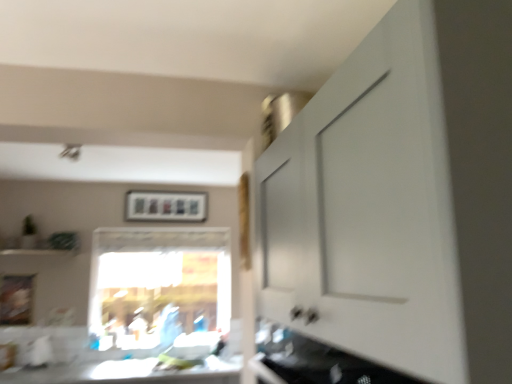
Measure the distance between point (x=263, y=327) and camera.

The depth of point (x=263, y=327) is 5.46 feet.

The height and width of the screenshot is (384, 512). I want to click on wooden picture frame at lower left, the second picture frame when ordered from right to left, so click(x=16, y=299).

How much space does matte plastic picture frame at upper center, which is the first picture frame from top to bottom, occupy horizontally?

The width of matte plastic picture frame at upper center, which is the first picture frame from top to bottom, is 3.11 inches.

This screenshot has width=512, height=384. Find the location of `white glossy cabinet at lower right, which is the first cabinetry from bottom to top`. white glossy cabinet at lower right, which is the first cabinetry from bottom to top is located at coordinates (315, 361).

Can you confirm if wooden picture frame at lower left, arranged as the second picture frame when viewed from the back, is thinner than white glossy countertop at lower center?

Yes.

Choose the correct answer: Is wooden picture frame at lower left, arranged as the second picture frame when viewed from the back, inside white glossy countertop at lower center or outside it?

wooden picture frame at lower left, arranged as the second picture frame when viewed from the back, lies outside white glossy countertop at lower center.

Does point (3, 299) lie in front of point (141, 383)?

That is False.

Is wooden picture frame at lower left, arranged as the 1th picture frame when ordered from the bottom, facing towards white glossy countertop at lower center?

No, wooden picture frame at lower left, arranged as the 1th picture frame when ordered from the bottom, is not aimed at white glossy countertop at lower center.

Is white matte cabinet at upper right, which appears as the first cabinetry when viewed from the top, located outside transparent glass window at center?

Indeed, white matte cabinet at upper right, which appears as the first cabinetry when viewed from the top, is completely outside transparent glass window at center.

Would you consider white matte cabinet at upper right, placed as the second cabinetry when sorted from bottom to top, to be distant from transparent glass window at center?

white matte cabinet at upper right, placed as the second cabinetry when sorted from bottom to top, is far away from transparent glass window at center.

Between white matte cabinet at upper right, which appears as the first cabinetry when viewed from the top, and transparent glass window at center, which one has smaller width?

transparent glass window at center is thinner.

Is white matte cabinet at upper right, which appears as the first cabinetry when viewed from the top, shorter than transparent glass window at center?

Yes.

Is white matte cabinet at upper right, placed as the second cabinetry when sorted from bottom to top, surrounding white glossy cabinet at lower right, which is the first cabinetry from bottom to top?

Absolutely, white glossy cabinet at lower right, which is the first cabinetry from bottom to top, is inside white matte cabinet at upper right, placed as the second cabinetry when sorted from bottom to top.

In the scene shown: From the image's perspective, which is above, white matte cabinet at upper right, which appears as the first cabinetry when viewed from the top, or white glossy cabinet at lower right, positioned as the 2th cabinetry in top-to-bottom order?

white matte cabinet at upper right, which appears as the first cabinetry when viewed from the top.

Is white matte cabinet at upper right, placed as the second cabinetry when sorted from bottom to top, facing towards white glossy cabinet at lower right, positioned as the 2th cabinetry in top-to-bottom order?

Yes, white matte cabinet at upper right, placed as the second cabinetry when sorted from bottom to top, faces towards white glossy cabinet at lower right, positioned as the 2th cabinetry in top-to-bottom order.

Considering the relative sizes of white glossy cabinet at lower right, positioned as the 2th cabinetry in top-to-bottom order, and white matte cabinet at upper right, which appears as the first cabinetry when viewed from the top, in the image provided, is white glossy cabinet at lower right, positioned as the 2th cabinetry in top-to-bottom order, taller than white matte cabinet at upper right, which appears as the first cabinetry when viewed from the top,?

In fact, white glossy cabinet at lower right, positioned as the 2th cabinetry in top-to-bottom order, may be shorter than white matte cabinet at upper right, which appears as the first cabinetry when viewed from the top.

How different are the orientations of white glossy cabinet at lower right, which is the first cabinetry from bottom to top, and white matte cabinet at upper right, which appears as the first cabinetry when viewed from the top, in degrees?

They differ by 0.000545 degrees in their facing directions.

How much distance is there between white glossy cabinet at lower right, positioned as the 2th cabinetry in top-to-bottom order, and white matte cabinet at upper right, placed as the second cabinetry when sorted from bottom to top?

11.42 inches.

Is point (273, 381) farther from viewer compared to point (289, 224)?

Yes.

At what (x,y) coordinates should I click in order to perform the action: click on the 2nd picture frame behind the white glossy cabinet at lower right, positioned as the 2th cabinetry in top-to-bottom order. Please return your answer as a coordinate pair (x, y). Looking at the image, I should click on (166, 206).

Consider the image. Is white glossy cabinet at lower right, positioned as the 2th cabinetry in top-to-bottom order, facing away from matte plastic picture frame at upper center, the first picture frame when ordered from back to front?

white glossy cabinet at lower right, positioned as the 2th cabinetry in top-to-bottom order, does not have its back to matte plastic picture frame at upper center, the first picture frame when ordered from back to front.

Is point (310, 381) closer to viewer compared to point (199, 218)?

Yes, point (310, 381) is closer to viewer.

Is white glossy cabinet at lower right, which is the first cabinetry from bottom to top, shorter than matte plastic picture frame at upper center, placed as the second picture frame when sorted from front to back?

Yes.

Is wooden picture frame at lower left, arranged as the second picture frame when viewed from the back, positioned with its back to white matte cabinet at upper right, which appears as the first cabinetry when viewed from the top?

wooden picture frame at lower left, arranged as the second picture frame when viewed from the back, is not turned away from white matte cabinet at upper right, which appears as the first cabinetry when viewed from the top.

Considering the sizes of wooden picture frame at lower left, arranged as the second picture frame when viewed from the back, and white matte cabinet at upper right, placed as the second cabinetry when sorted from bottom to top, in the image, is wooden picture frame at lower left, arranged as the second picture frame when viewed from the back, taller or shorter than white matte cabinet at upper right, placed as the second cabinetry when sorted from bottom to top,?

wooden picture frame at lower left, arranged as the second picture frame when viewed from the back, is shorter than white matte cabinet at upper right, placed as the second cabinetry when sorted from bottom to top.

From a real-world perspective, between wooden picture frame at lower left, arranged as the 1th picture frame when ordered from the bottom, and white matte cabinet at upper right, which appears as the first cabinetry when viewed from the top, who is vertically lower?

From a 3D spatial view, wooden picture frame at lower left, arranged as the 1th picture frame when ordered from the bottom, is below.

Does wooden picture frame at lower left, arranged as the second picture frame when viewed from the back, have a greater width compared to white matte cabinet at upper right, placed as the second cabinetry when sorted from bottom to top?

No, wooden picture frame at lower left, arranged as the second picture frame when viewed from the back, is not wider than white matte cabinet at upper right, placed as the second cabinetry when sorted from bottom to top.

Between white matte cabinet at upper right, which appears as the first cabinetry when viewed from the top, and wooden picture frame at lower left, marked as the first picture frame in a left-to-right arrangement, which one has less height?

With less height is wooden picture frame at lower left, marked as the first picture frame in a left-to-right arrangement.

Is white matte cabinet at upper right, placed as the second cabinetry when sorted from bottom to top, far away from wooden picture frame at lower left, arranged as the 1th picture frame when ordered from the bottom?

white matte cabinet at upper right, placed as the second cabinetry when sorted from bottom to top, is positioned a significant distance from wooden picture frame at lower left, arranged as the 1th picture frame when ordered from the bottom.

Which is behind, white matte cabinet at upper right, placed as the second cabinetry when sorted from bottom to top, or wooden picture frame at lower left, arranged as the second picture frame when viewed from the back?

wooden picture frame at lower left, arranged as the second picture frame when viewed from the back.

From a real-world perspective, is white matte cabinet at upper right, which appears as the first cabinetry when viewed from the top, on wooden picture frame at lower left, arranged as the 1th picture frame when ordered from the bottom?

Yes, from a real-world perspective, white matte cabinet at upper right, which appears as the first cabinetry when viewed from the top, is on top of wooden picture frame at lower left, arranged as the 1th picture frame when ordered from the bottom.

I want to click on counter top that is in front of the wooden picture frame at lower left, arranged as the 1th picture frame when ordered from the bottom, so click(x=122, y=373).

In the image, there is a white matte cabinet at upper right, which appears as the first cabinetry when viewed from the top. Where is `window below it (from a real-world perspective)`? The width and height of the screenshot is (512, 384). window below it (from a real-world perspective) is located at coordinates (160, 290).

Looking at the image, which one is located further to transparent glass window at center, white glossy countertop at lower center or white matte cabinet at upper right, which appears as the first cabinetry when viewed from the top?

white matte cabinet at upper right, which appears as the first cabinetry when viewed from the top, is positioned further to the anchor transparent glass window at center.

From the picture: Based on their spatial positions, is wooden picture frame at lower left, the second picture frame when ordered from right to left, or transparent glass window at center further from white matte cabinet at upper right, which appears as the first cabinetry when viewed from the top?

wooden picture frame at lower left, the second picture frame when ordered from right to left, lies further to white matte cabinet at upper right, which appears as the first cabinetry when viewed from the top, than the other object.

Estimate the real-world distances between objects in this image. Which object is further from white glossy countertop at lower center, white glossy cabinet at lower right, positioned as the 2th cabinetry in top-to-bottom order, or transparent glass window at center?

Based on the image, white glossy cabinet at lower right, positioned as the 2th cabinetry in top-to-bottom order, appears to be further to white glossy countertop at lower center.

When comparing their distances from white glossy cabinet at lower right, positioned as the 2th cabinetry in top-to-bottom order, does white matte cabinet at upper right, placed as the second cabinetry when sorted from bottom to top, or wooden picture frame at lower left, arranged as the second picture frame when viewed from the back, seem further?

Among the two, wooden picture frame at lower left, arranged as the second picture frame when viewed from the back, is located further to white glossy cabinet at lower right, positioned as the 2th cabinetry in top-to-bottom order.

From the image, which object appears to be nearer to matte plastic picture frame at upper center, the first picture frame when ordered from back to front, white glossy countertop at lower center or wooden picture frame at lower left, the 1th picture frame viewed from the front?

Among the two, wooden picture frame at lower left, the 1th picture frame viewed from the front, is located nearer to matte plastic picture frame at upper center, the first picture frame when ordered from back to front.

Which object lies nearer to the anchor point white matte cabinet at upper right, which appears as the first cabinetry when viewed from the top, white glossy cabinet at lower right, positioned as the 2th cabinetry in top-to-bottom order, or wooden picture frame at lower left, positioned as the 2th picture frame in top-to-bottom order?

The object closer to white matte cabinet at upper right, which appears as the first cabinetry when viewed from the top, is white glossy cabinet at lower right, positioned as the 2th cabinetry in top-to-bottom order.

Considering their positions, is white matte cabinet at upper right, placed as the second cabinetry when sorted from bottom to top, positioned closer to wooden picture frame at lower left, positioned as the 2th picture frame in top-to-bottom order, than white glossy cabinet at lower right, which is the first cabinetry from bottom to top?

white glossy cabinet at lower right, which is the first cabinetry from bottom to top, lies closer to wooden picture frame at lower left, positioned as the 2th picture frame in top-to-bottom order, than the other object.

From the image, which object appears to be farther from transparent glass window at center, matte plastic picture frame at upper center, the first picture frame when ordered from back to front, or wooden picture frame at lower left, the 1th picture frame viewed from the front?

wooden picture frame at lower left, the 1th picture frame viewed from the front, lies further to transparent glass window at center than the other object.

Find the location of `cabinetry between white matte cabinet at upper right, placed as the second cabinetry when sorted from bottom to top, and matte plastic picture frame at upper center, which is the first picture frame from top to bottom, from front to back`. cabinetry between white matte cabinet at upper right, placed as the second cabinetry when sorted from bottom to top, and matte plastic picture frame at upper center, which is the first picture frame from top to bottom, from front to back is located at coordinates (315, 361).

Find the location of a particular element. window between white glossy cabinet at lower right, which is the first cabinetry from bottom to top, and matte plastic picture frame at upper center, which is the first picture frame from top to bottom, along the z-axis is located at coordinates tap(160, 290).

The width and height of the screenshot is (512, 384). Identify the location of window between wooden picture frame at lower left, marked as the first picture frame in a left-to-right arrangement, and white glossy countertop at lower center. (160, 290).

The height and width of the screenshot is (384, 512). Find the location of `counter top positioned between white glossy cabinet at lower right, which is the first cabinetry from bottom to top, and transparent glass window at center from near to far`. counter top positioned between white glossy cabinet at lower right, which is the first cabinetry from bottom to top, and transparent glass window at center from near to far is located at coordinates (122, 373).